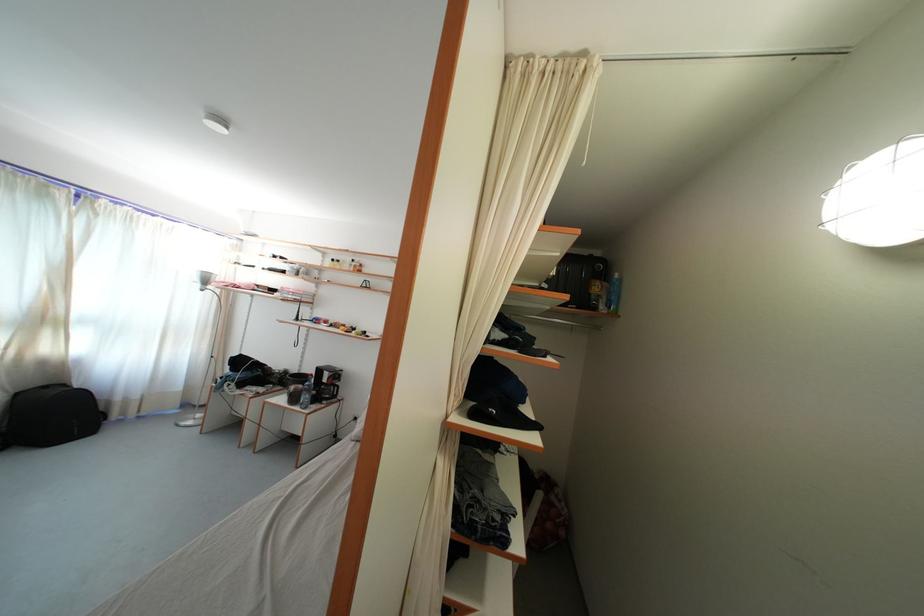
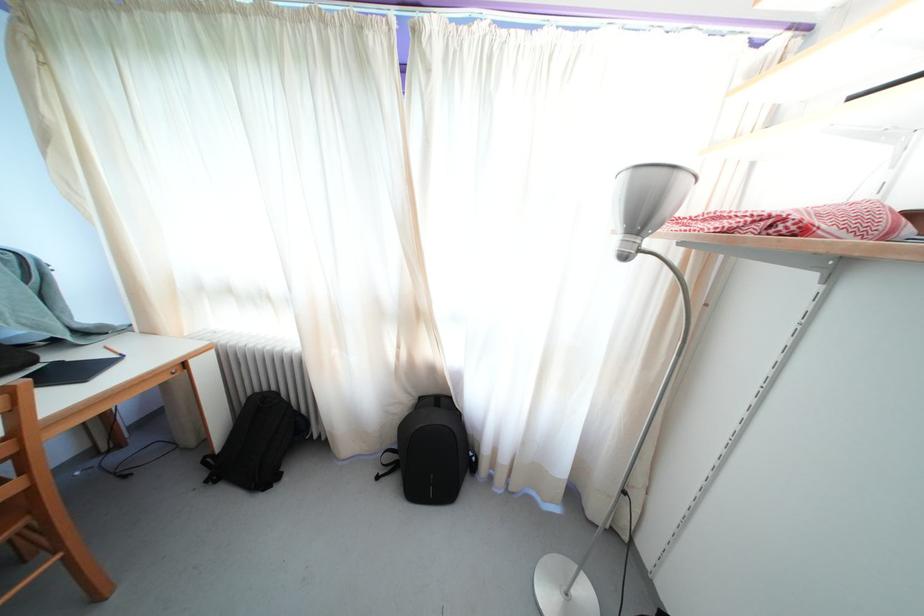
In the second image, find the point that corresponds to point 213,286 in the first image.

(648, 223)